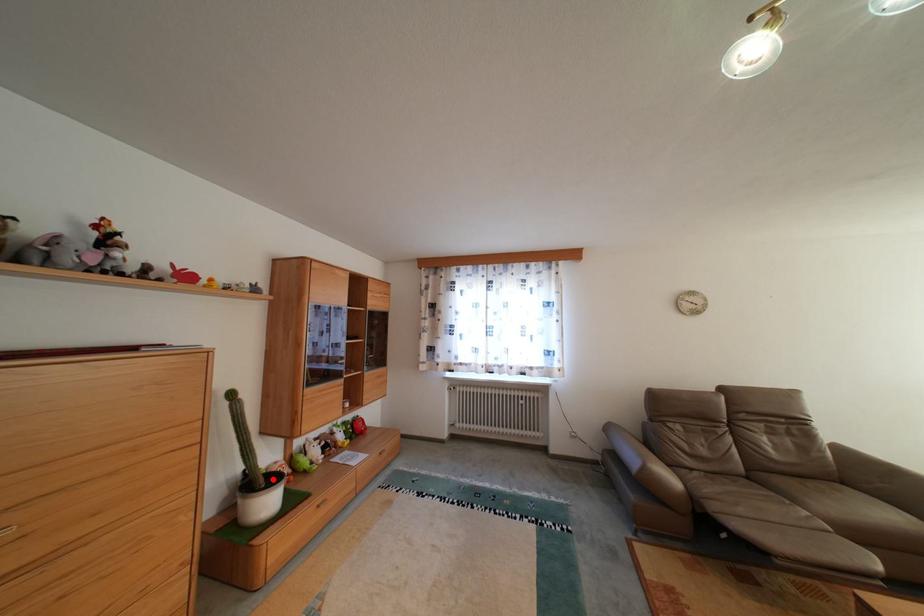
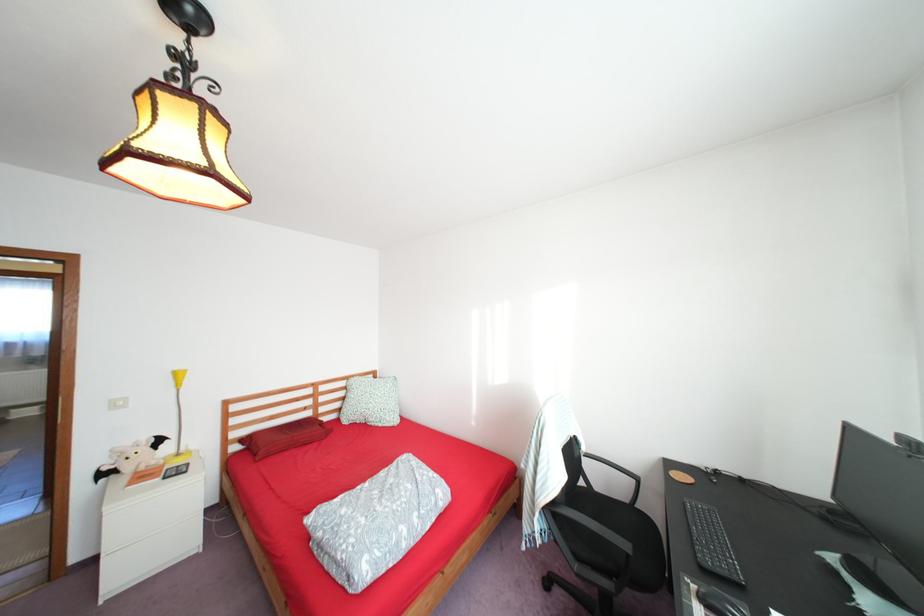
Question: I am providing you with two images of the same scene from different viewpoints. A red point is marked on the first image. Can you still see the location of the red point in image 2?

Choices:
 (A) Yes
 (B) No

Answer: (B)